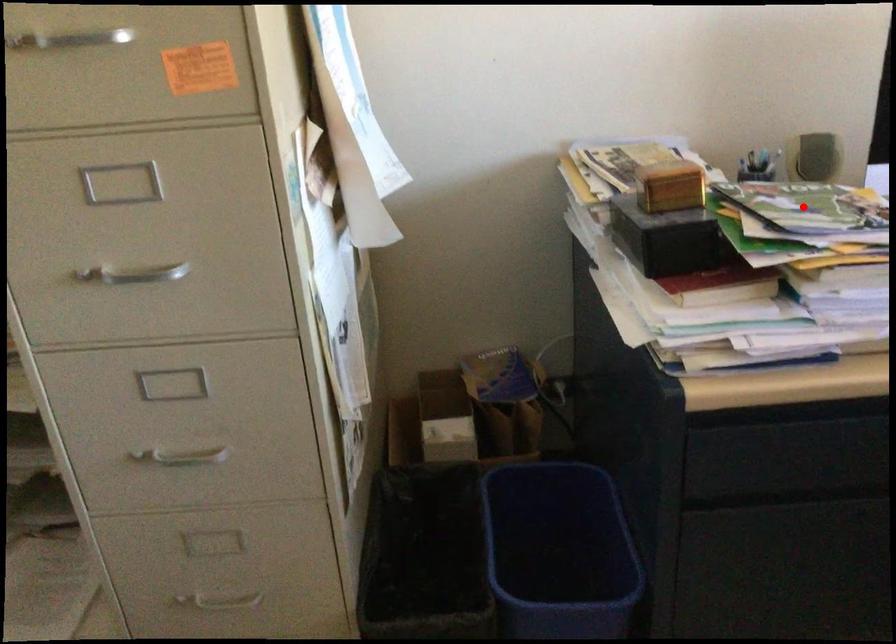
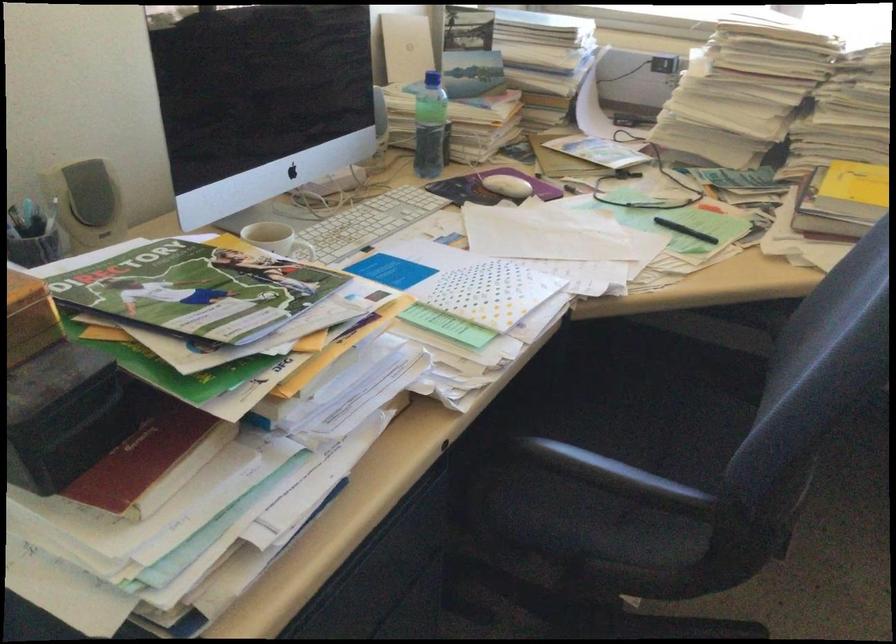
Question: I am providing you with two images of the same scene from different viewpoints. Image1 has a red point marked. In image2, the corresponding 3D location appears at what relative position? Reply with the corresponding letter.

Choices:
 (A) Closer
 (B) Farther

Answer: (A)